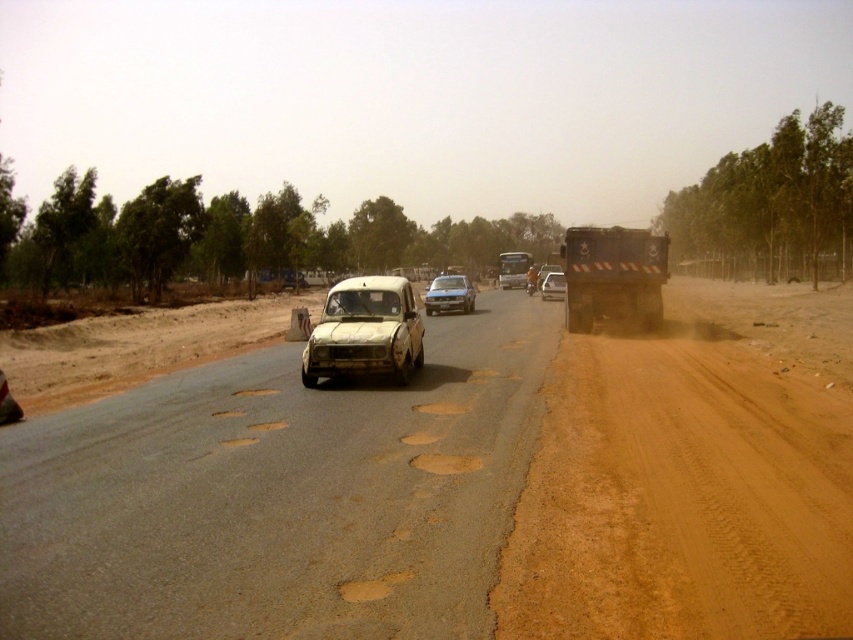
Looking at this image, you are driving a car and need to pass through the rural road shown in the image. The road has two lanes. You see a white matte car at center and a metallic silver bus at center. Which vehicle takes up more space on the road?

The metallic silver bus at center takes up more space on the road because it is larger than the white matte car at center according to the description.

You are driving a car and want to overtake the metallic gray truck at right and the metallic silver bus at center on this rural road. Given the road conditions described, which vehicle would be easier to overtake?

The metallic gray truck at right has a lesser width compared to the metallic silver bus at center, so it would be easier to overtake the metallic gray truck at right since it requires less space to pass.